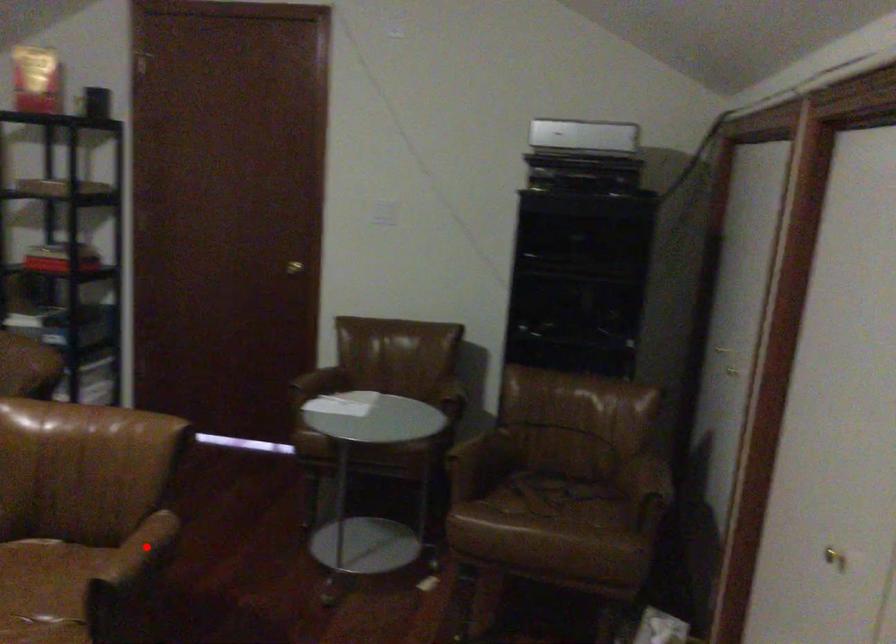
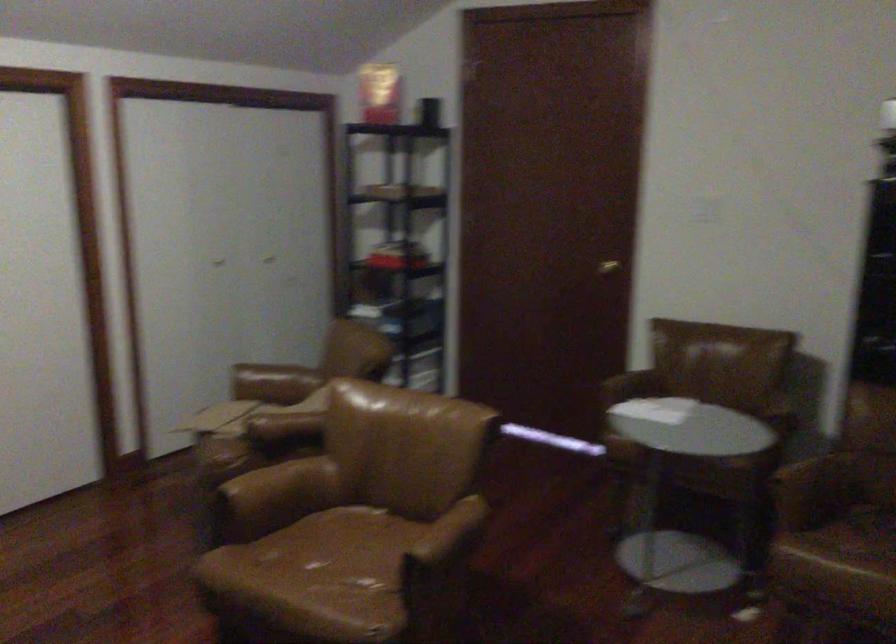
In the second image, find the point that corresponds to the highlighted location in the first image.

(448, 536)